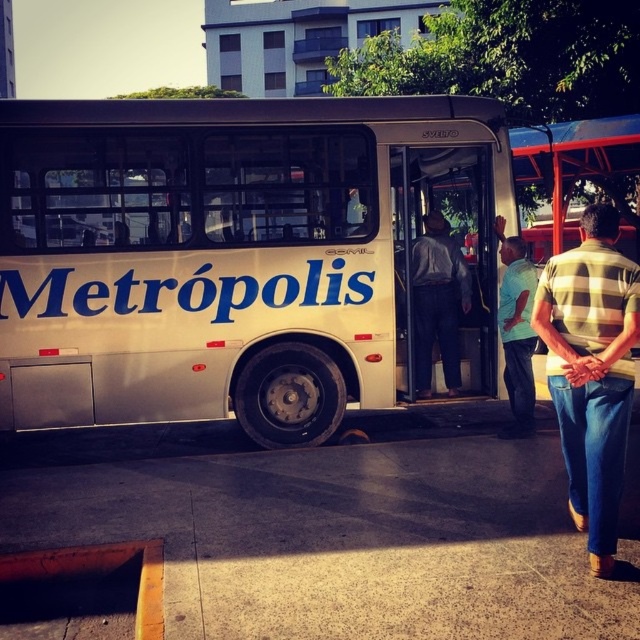
You are a maintenance worker checking the height of the white metallic bus at center and dark gray pants at center. Which object is taller?

The white metallic bus at center is taller than dark gray pants at center.

You are standing at the origin point of the coordinate system. The white metallic bus at center is located at point 0.400, 0.364. If you want to walk towards it, in which direction should you move?

Since the white metallic bus at center is located at coordinates (232,256), you should move northeast to reach it from the origin point.